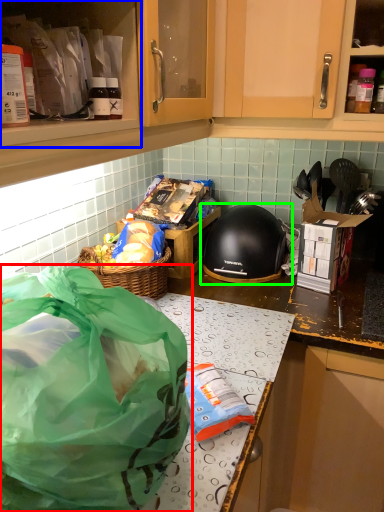
Question: Which object is the closest to the plastic bag (highlighted by a red box)? Choose among these: cabinetry (highlighted by a blue box) or helmet (highlighted by a green box).

Choices:
 (A) cabinetry
 (B) helmet

Answer: (A)